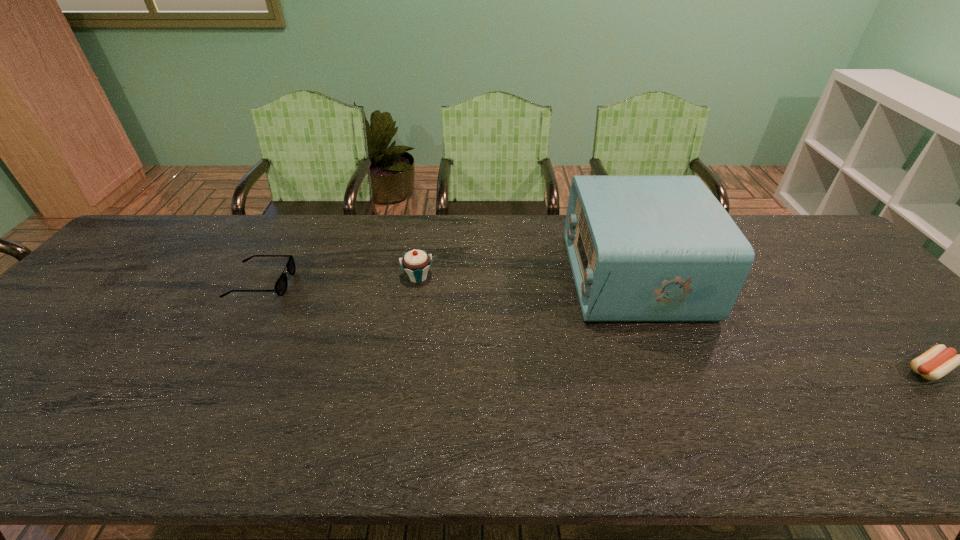
This screenshot has width=960, height=540. I want to click on object that is at the far edge, so click(x=641, y=248).

The width and height of the screenshot is (960, 540). Find the location of `free region at the far edge`. free region at the far edge is located at coordinates (421, 227).

Locate an element on the screen. The image size is (960, 540). vacant space at the near edge of the desktop is located at coordinates (234, 456).

The width and height of the screenshot is (960, 540). In the image, there is a desktop. What are the coordinates of `vacant area at the left edge` in the screenshot? It's located at (41, 335).

Locate an element on the screen. The image size is (960, 540). vacant area at the right edge is located at coordinates (900, 319).

The image size is (960, 540). Identify the location of vacant region at the far left corner of the desktop. (128, 247).

The height and width of the screenshot is (540, 960). I want to click on free space at the far right corner of the desktop, so click(825, 237).

Locate an element on the screen. free space between the tallest object and the leftmost object is located at coordinates (447, 279).

What are the coordinates of `vacant space in between the second object from left to right and the spectacles` in the screenshot? It's located at (340, 280).

Point out which object is positioned as the nearest to the radio receiver. Please provide its 2D coordinates. Your answer should be formatted as a tuple, i.e. [(x, y)], where the tuple contains the x and y coordinates of a point satisfying the conditions above.

[(938, 361)]